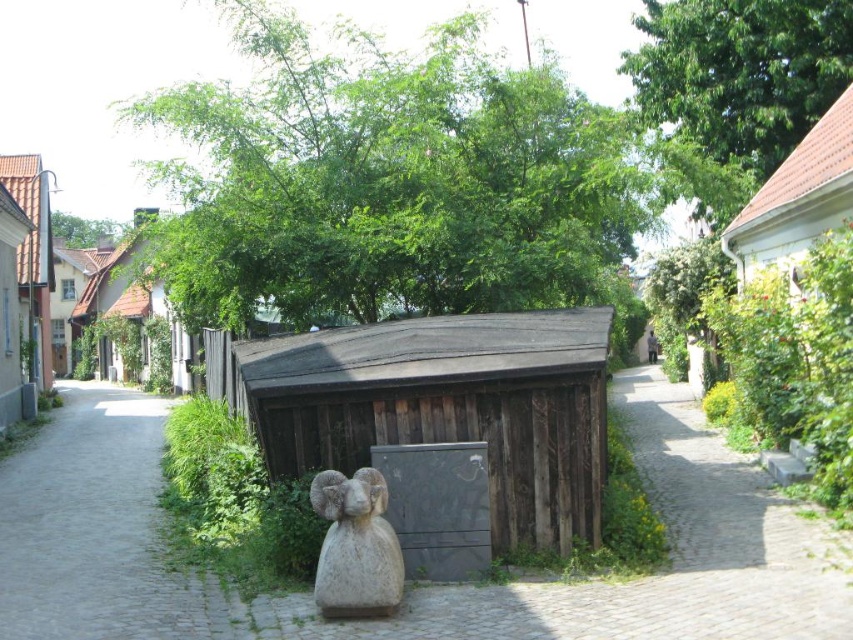
You are a painter standing at the end of the cobblestone street depicted in the scene. You want to capture the view of the brown wooden hut at upper center and the green leafy tree at upper center in your painting. Which object should you focus on first if you want to paint the taller one?

The brown wooden hut at upper center is taller than the green leafy tree at upper center, so you should focus on painting the brown wooden hut at upper center first.

You are a delivery person trying to navigate through the narrow cobblestone street. You see the dark brown wood at center and the brown wooden hut at left. Which object is wider, allowing more space between them for your delivery van?

The dark brown wood at center is wider than the brown wooden hut at left, so there is more space between them for the delivery van.

You are a delivery person with a cart that needs to navigate through the narrow cobblestone street. The cart requires a minimum of 10 meters of space between obstacles to pass safely. Can you safely pass between the green leafy tree at center and the brown wooden hut at upper right?

The distance between the green leafy tree at center and the brown wooden hut at upper right is 9.13 meters, which is less than the required 10 meters. Therefore, you cannot safely pass between them with the cart.